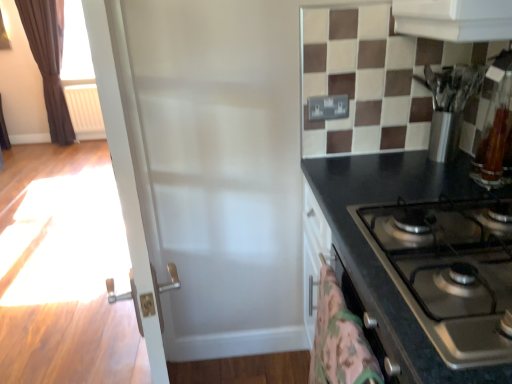
Question: Considering the relative sizes of fluffy pink blanket at lower right and brown velvet curtain at left in the image provided, is fluffy pink blanket at lower right thinner than brown velvet curtain at left?

Choices:
 (A) no
 (B) yes

Answer: (B)

Question: Is fluffy pink blanket at lower right looking in the opposite direction of brown velvet curtain at left?

Choices:
 (A) no
 (B) yes

Answer: (A)

Question: Is fluffy pink blanket at lower right not near brown velvet curtain at left?

Choices:
 (A) no
 (B) yes

Answer: (B)

Question: Can you confirm if fluffy pink blanket at lower right is taller than brown velvet curtain at left?

Choices:
 (A) yes
 (B) no

Answer: (B)

Question: Can you confirm if fluffy pink blanket at lower right is positioned to the right of brown velvet curtain at left?

Choices:
 (A) yes
 (B) no

Answer: (A)

Question: Considering the positions of brown velvet curtain at left and white glossy door at center in the image, is brown velvet curtain at left taller or shorter than white glossy door at center?

Choices:
 (A) short
 (B) tall

Answer: (B)

Question: Is point (61, 132) positioned closer to the camera than point (138, 218)?

Choices:
 (A) closer
 (B) farther

Answer: (B)

Question: From the image's perspective, relative to white glossy door at center, is brown velvet curtain at left above or below?

Choices:
 (A) below
 (B) above

Answer: (B)

Question: Considering their positions, is brown velvet curtain at left located in front of or behind white glossy door at center?

Choices:
 (A) front
 (B) behind

Answer: (B)

Question: Do you think white glossy door at center is within white plastic radiator at left, or outside of it?

Choices:
 (A) outside
 (B) inside

Answer: (A)

Question: Considering the positions of point coord(124,109) and point coord(67,99), is point coord(124,109) closer or farther from the camera than point coord(67,99)?

Choices:
 (A) closer
 (B) farther

Answer: (A)

Question: Looking at the image, does white glossy door at center seem bigger or smaller compared to white plastic radiator at left?

Choices:
 (A) small
 (B) big

Answer: (B)

Question: In the image, is white glossy door at center on the left side or the right side of white plastic radiator at left?

Choices:
 (A) right
 (B) left

Answer: (A)

Question: In the image, is white plastic radiator at left positioned in front of or behind brown velvet curtain at left?

Choices:
 (A) behind
 (B) front

Answer: (A)

Question: Considering the positions of white plastic radiator at left and brown velvet curtain at left in the image, is white plastic radiator at left wider or thinner than brown velvet curtain at left?

Choices:
 (A) thin
 (B) wide

Answer: (A)